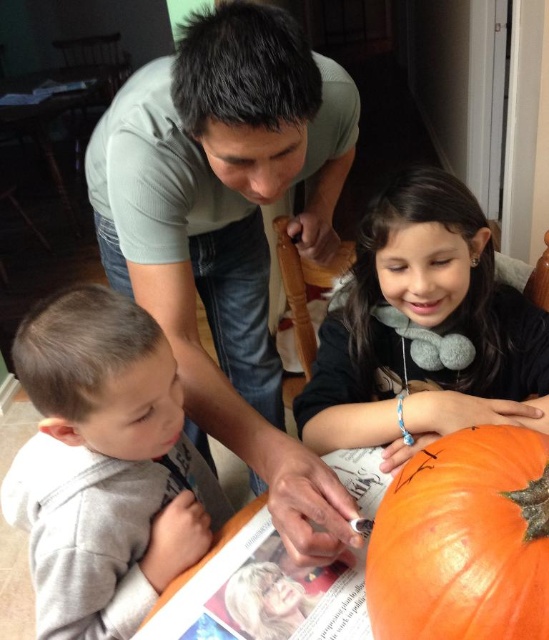
You are a child trying to reach both the orange pumpkin at lower center and the matte orange pumpkin at center. Which pumpkin is closer to you?

The orange pumpkin at lower center is closer to you since it is positioned below the matte orange pumpkin at center, which is higher up.

You are a photographer trying to capture the scene of the pumpkin carving. You notice the matte green shirt at upper center and the orange pumpkin at lower center. Which object should you focus on first if you want to highlight the one that is taller?

The matte green shirt at upper center is taller than the orange pumpkin at lower center, so you should focus on the matte green shirt at upper center first.

You are a photographer setting up a shot of the pumpkin carving scene. You need to ensure both the gray fleece shirt at lower left and the orange matte pumpkin at lower right are in focus. Given their sizes, which object should you adjust your camera focus on first to ensure proper framing?

The gray fleece shirt at lower left has a larger size compared to the orange matte pumpkin at lower right, so you should focus on the gray fleece shirt at lower left first to ensure it fits properly within the frame before adjusting for the smaller pumpkin.